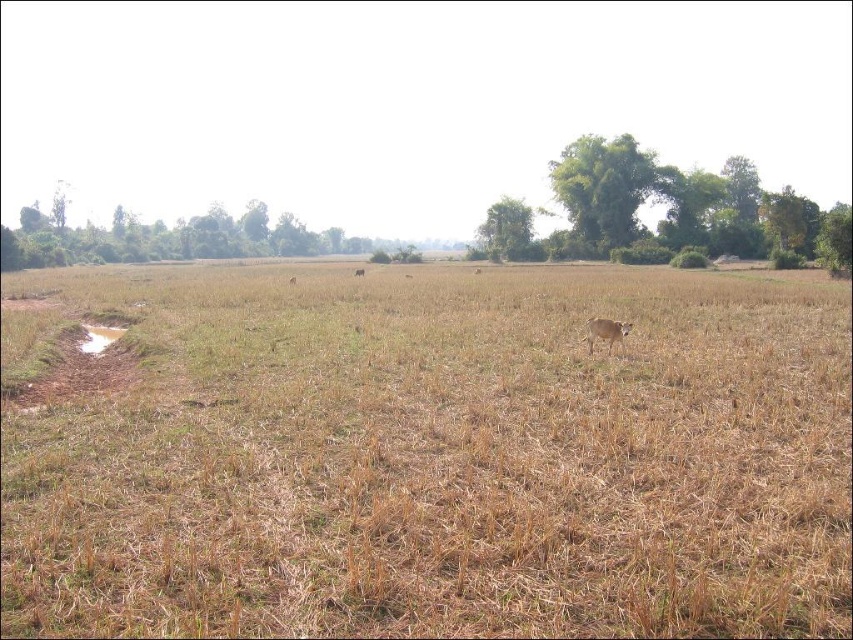
Question: Which object is the farthest from the brown furry cow at center?

Choices:
 (A) brown dry grass at center
 (B) brown matte cow at center

Answer: (B)

Question: Estimate the real-world distances between objects in this image. Which object is farther from the brown matte cow at center?

Choices:
 (A) brown furry cow at center
 (B) brown dry grass at center

Answer: (A)

Question: Can you confirm if brown dry grass at center is positioned above brown furry cow at center?

Choices:
 (A) no
 (B) yes

Answer: (B)

Question: Does brown dry grass at center appear on the left side of brown matte cow at center?

Choices:
 (A) no
 (B) yes

Answer: (A)

Question: Which object is positioned closest to the brown matte cow at center?

Choices:
 (A) brown furry cow at center
 (B) brown dry grass at center

Answer: (B)

Question: Does brown furry cow at center have a smaller size compared to brown matte cow at center?

Choices:
 (A) no
 (B) yes

Answer: (B)